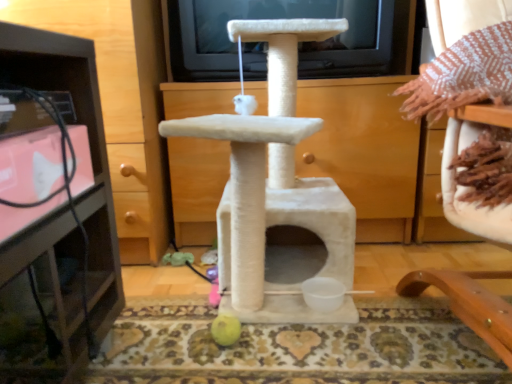
This screenshot has height=384, width=512. I want to click on beige fabric chair at upper right, the 1th furniture in the right-to-left sequence, so click(x=469, y=303).

What is the approximate width of beige fabric chair at upper right, the second furniture in the left-to-right sequence?

beige fabric chair at upper right, the second furniture in the left-to-right sequence, is 27.64 inches in width.

What do you see at coordinates (469, 303) in the screenshot?
I see `beige fabric chair at upper right, which appears as the 1th furniture when viewed from the front` at bounding box center [469, 303].

Identify the location of brushed metal tv stand at left, the 1th furniture positioned from the left. (60, 148).

The width and height of the screenshot is (512, 384). What do you see at coordinates (60, 148) in the screenshot?
I see `brushed metal tv stand at left, which ranks as the 1th furniture in back-to-front order` at bounding box center [60, 148].

Measure the distance between point (41, 70) and camera.

Point (41, 70) and camera are 79.10 centimeters apart from each other.

Where is `beige fabric chair at upper right, the 1th furniture in the right-to-left sequence`? This screenshot has width=512, height=384. beige fabric chair at upper right, the 1th furniture in the right-to-left sequence is located at coordinates (469, 303).

Between beige fabric chair at upper right, the second furniture in the left-to-right sequence, and brushed metal tv stand at left, which is the second furniture from front to back, which one appears on the right side from the viewer's perspective?

beige fabric chair at upper right, the second furniture in the left-to-right sequence.

Between beige fabric chair at upper right, which appears as the 1th furniture when viewed from the front, and brushed metal tv stand at left, which is the second furniture from front to back, which one is positioned in front?

Positioned in front is beige fabric chair at upper right, which appears as the 1th furniture when viewed from the front.

Does point (448, 162) appear closer or farther from the camera than point (64, 301)?

Point (448, 162) is positioned farther from the camera compared to point (64, 301).

From the image's perspective, which one is positioned higher, beige fabric chair at upper right, the 1th furniture in the right-to-left sequence, or brushed metal tv stand at left, the 1th furniture positioned from the left?

brushed metal tv stand at left, the 1th furniture positioned from the left, appears higher in the image.

From a real-world perspective, between beige fabric chair at upper right, which appears as the 1th furniture when viewed from the front, and brushed metal tv stand at left, the second furniture when ordered from right to left, who is vertically higher?

brushed metal tv stand at left, the second furniture when ordered from right to left, from a real-world perspective.

Considering the sizes of objects beige fabric chair at upper right, which is the second furniture from back to front, and brushed metal tv stand at left, the second furniture when ordered from right to left, in the image provided, who is wider, beige fabric chair at upper right, which is the second furniture from back to front, or brushed metal tv stand at left, the second furniture when ordered from right to left,?

beige fabric chair at upper right, which is the second furniture from back to front.

In terms of height, does beige fabric chair at upper right, the second furniture in the left-to-right sequence, look taller or shorter compared to brushed metal tv stand at left, which ranks as the 1th furniture in back-to-front order?

Clearly, beige fabric chair at upper right, the second furniture in the left-to-right sequence, is shorter compared to brushed metal tv stand at left, which ranks as the 1th furniture in back-to-front order.

Considering the sizes of objects beige fabric chair at upper right, the 1th furniture in the right-to-left sequence, and brushed metal tv stand at left, the second furniture when ordered from right to left, in the image provided, who is smaller, beige fabric chair at upper right, the 1th furniture in the right-to-left sequence, or brushed metal tv stand at left, the second furniture when ordered from right to left,?

Smaller between the two is beige fabric chair at upper right, the 1th furniture in the right-to-left sequence.

Is brushed metal tv stand at left, which ranks as the 1th furniture in back-to-front order, completely or partially inside beige fabric chair at upper right, the second furniture in the left-to-right sequence?

No, brushed metal tv stand at left, which ranks as the 1th furniture in back-to-front order, is not inside beige fabric chair at upper right, the second furniture in the left-to-right sequence.

Can you see beige fabric chair at upper right, the second furniture in the left-to-right sequence, touching brushed metal tv stand at left, which is the second furniture from front to back?

No, beige fabric chair at upper right, the second furniture in the left-to-right sequence, is not with brushed metal tv stand at left, which is the second furniture from front to back.

Is beige fabric chair at upper right, which appears as the 1th furniture when viewed from the front, oriented towards brushed metal tv stand at left, which is the second furniture from front to back?

No, beige fabric chair at upper right, which appears as the 1th furniture when viewed from the front, does not turn towards brushed metal tv stand at left, which is the second furniture from front to back.

How different are the orientations of beige fabric chair at upper right, the 1th furniture in the right-to-left sequence, and brushed metal tv stand at left, the second furniture when ordered from right to left, in degrees?

beige fabric chair at upper right, the 1th furniture in the right-to-left sequence, and brushed metal tv stand at left, the second furniture when ordered from right to left, are facing 0.182 degrees away from each other.

Find the location of a particular element. furniture above the beige fabric chair at upper right, which is the second furniture from back to front (from a real-world perspective) is located at coordinates (60, 148).

Which is more to the right, brushed metal tv stand at left, which ranks as the 1th furniture in back-to-front order, or beige fabric chair at upper right, the second furniture in the left-to-right sequence?

From the viewer's perspective, beige fabric chair at upper right, the second furniture in the left-to-right sequence, appears more on the right side.

Is brushed metal tv stand at left, the 1th furniture positioned from the left, positioned behind beige fabric chair at upper right, the second furniture in the left-to-right sequence?

Yes, brushed metal tv stand at left, the 1th furniture positioned from the left, is further from the viewer.

Does point (2, 368) appear closer or farther from the camera than point (495, 295)?

Point (2, 368) appears to be closer to the viewer than point (495, 295).

From the image's perspective, is brushed metal tv stand at left, which ranks as the 1th furniture in back-to-front order, under beige fabric chair at upper right, which appears as the 1th furniture when viewed from the front?

No, from the image's perspective, brushed metal tv stand at left, which ranks as the 1th furniture in back-to-front order, is not beneath beige fabric chair at upper right, which appears as the 1th furniture when viewed from the front.

From a real-world perspective, is brushed metal tv stand at left, the second furniture when ordered from right to left, beneath beige fabric chair at upper right, which is the second furniture from back to front?

No, from a real-world perspective, brushed metal tv stand at left, the second furniture when ordered from right to left, is not beneath beige fabric chair at upper right, which is the second furniture from back to front.

Which object is wider, brushed metal tv stand at left, which ranks as the 1th furniture in back-to-front order, or beige fabric chair at upper right, which appears as the 1th furniture when viewed from the front?

With larger width is beige fabric chair at upper right, which appears as the 1th furniture when viewed from the front.

In terms of height, does brushed metal tv stand at left, which ranks as the 1th furniture in back-to-front order, look taller or shorter compared to beige fabric chair at upper right, the second furniture in the left-to-right sequence?

Clearly, brushed metal tv stand at left, which ranks as the 1th furniture in back-to-front order, is taller compared to beige fabric chair at upper right, the second furniture in the left-to-right sequence.

Looking at the image, does brushed metal tv stand at left, the 1th furniture positioned from the left, seem bigger or smaller compared to beige fabric chair at upper right, which appears as the 1th furniture when viewed from the front?

Clearly, brushed metal tv stand at left, the 1th furniture positioned from the left, is larger in size than beige fabric chair at upper right, which appears as the 1th furniture when viewed from the front.

From the picture: Is brushed metal tv stand at left, the second furniture when ordered from right to left, inside the boundaries of beige fabric chair at upper right, which appears as the 1th furniture when viewed from the front, or outside?

brushed metal tv stand at left, the second furniture when ordered from right to left, is located beyond the bounds of beige fabric chair at upper right, which appears as the 1th furniture when viewed from the front.

Is the surface of brushed metal tv stand at left, which is the second furniture from front to back, in direct contact with beige fabric chair at upper right, the 1th furniture in the right-to-left sequence?

No, brushed metal tv stand at left, which is the second furniture from front to back, is not with beige fabric chair at upper right, the 1th furniture in the right-to-left sequence.

Is brushed metal tv stand at left, the 1th furniture positioned from the left, aimed at beige fabric chair at upper right, which is the second furniture from back to front?

No, brushed metal tv stand at left, the 1th furniture positioned from the left, does not turn towards beige fabric chair at upper right, which is the second furniture from back to front.

How much distance is there between brushed metal tv stand at left, the second furniture when ordered from right to left, and beige fabric chair at upper right, which appears as the 1th furniture when viewed from the front?

They are 27.50 inches apart.

Where is `furniture located above the beige fabric chair at upper right, which is the second furniture from back to front (from a real-world perspective)`? The width and height of the screenshot is (512, 384). furniture located above the beige fabric chair at upper right, which is the second furniture from back to front (from a real-world perspective) is located at coordinates (x=60, y=148).

This screenshot has width=512, height=384. I want to click on furniture below the brushed metal tv stand at left, which is the second furniture from front to back (from a real-world perspective), so pos(469,303).

What are the coordinates of `furniture lying above the beige fabric chair at upper right, which is the second furniture from back to front (from the image's perspective)` in the screenshot? It's located at (60, 148).